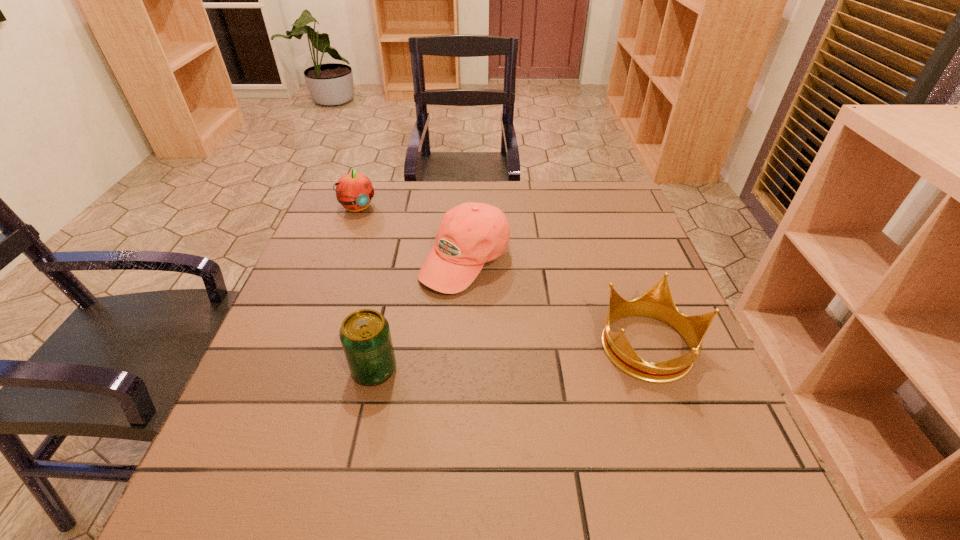
In order to click on free space on the desktop that is between the third object from right to left and the rightmost object and is positioned on the surface of the leftmost object in this screenshot , I will do `click(501, 359)`.

Identify the location of free spot on the desktop that is between the beer can and the crown and is positioned on the front-facing side of the second object from right to left. The image size is (960, 540). (524, 357).